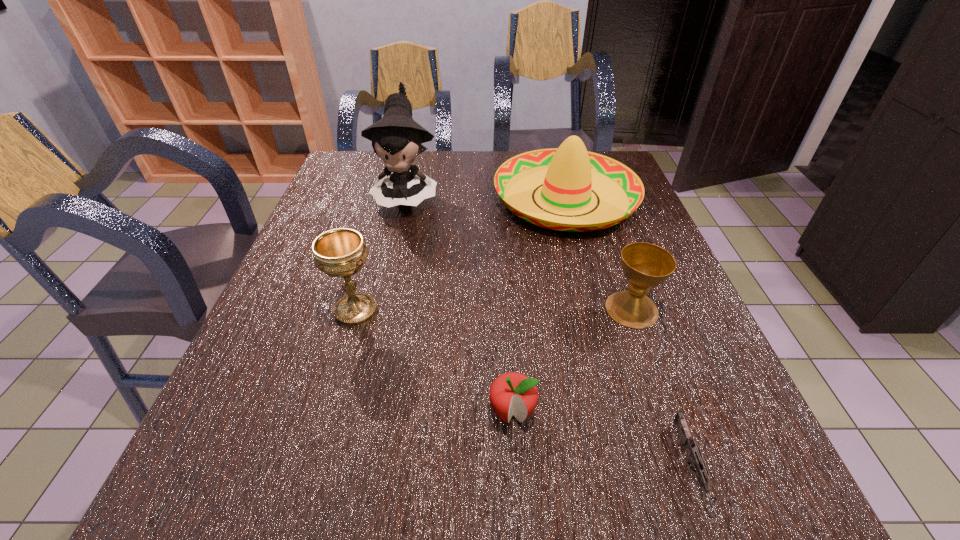
This screenshot has height=540, width=960. What are the coordinates of `the tallest object` in the screenshot? It's located at (396, 138).

Locate an element on the screen. sombrero is located at coordinates (569, 173).

Locate an element on the screen. the taller chalice is located at coordinates (341, 252).

Identify the location of the third shortest object. The height and width of the screenshot is (540, 960). (645, 265).

Where is `the right chalice`? the right chalice is located at coordinates (645, 265).

Locate an element on the screen. This screenshot has height=540, width=960. the second shortest object is located at coordinates (512, 393).

Locate an element on the screen. This screenshot has height=540, width=960. the shortest object is located at coordinates (695, 457).

Where is `vacant space situated at the face of the tallest object`? The height and width of the screenshot is (540, 960). vacant space situated at the face of the tallest object is located at coordinates (383, 299).

Locate an element on the screen. This screenshot has height=540, width=960. vacant space located on the front of the sombrero is located at coordinates (610, 362).

Locate an element on the screen. This screenshot has height=540, width=960. free space located on the back of the left chalice is located at coordinates (387, 204).